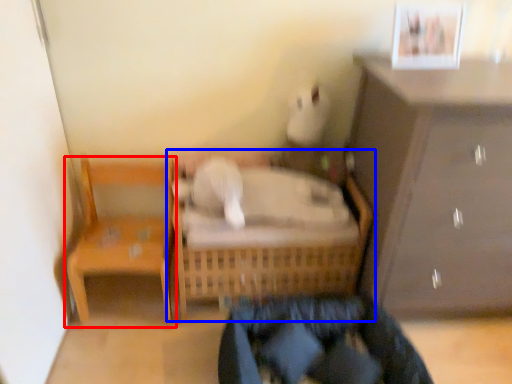
Question: Which point is closer to the camera, chair (highlighted by a red box) or furniture (highlighted by a blue box)?

Choices:
 (A) chair
 (B) furniture

Answer: (A)